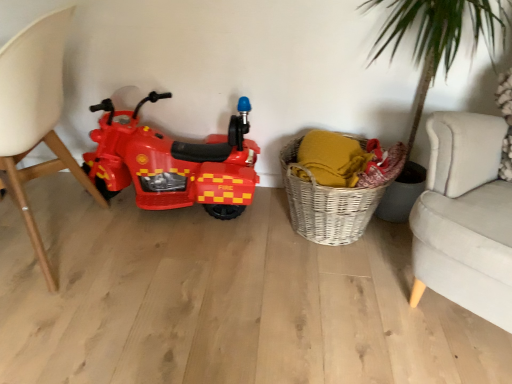
The width and height of the screenshot is (512, 384). What are the coordinates of `vacant region to the left of woven wicker basket at lower right` in the screenshot? It's located at (236, 239).